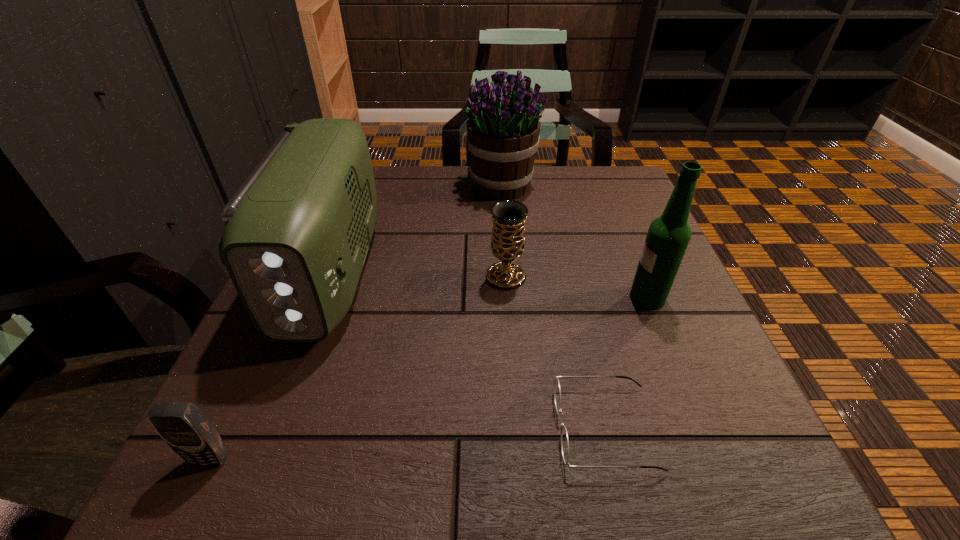
At what (x,y) coordinates should I click in order to perform the action: click on the farthest object. Please return your answer as a coordinate pair (x, y). Looking at the image, I should click on (503, 128).

I want to click on beer bottle, so click(668, 236).

Find the location of `radio_receiver`. radio_receiver is located at coordinates (297, 232).

Locate an element on the screen. The image size is (960, 540). chalice is located at coordinates (508, 216).

You are a GUI agent. You are given a task and a screenshot of the screen. Output one action in this format:
    pyautogui.click(x=<x>, y=<y>)
    Task: Click on the second shortest object
    
    Given the screenshot: What is the action you would take?
    pyautogui.click(x=181, y=425)

I want to click on spectacles, so click(x=557, y=391).

In order to click on free space located on the right of the farthest object in this screenshot , I will do `click(571, 186)`.

You are a GUI agent. You are given a task and a screenshot of the screen. Output one action in this format:
    pyautogui.click(x=<x>, y=<y>)
    Task: Click on the free space located on the label of the beer bottle
    The width and height of the screenshot is (960, 540).
    Given the screenshot: What is the action you would take?
    pyautogui.click(x=423, y=298)

The height and width of the screenshot is (540, 960). Identify the location of vacant space located 0.090m on the label of the beer bottle. (582, 298).

Identify the location of vacant space situated on the label of the beer bottle. The width and height of the screenshot is (960, 540). (471, 298).